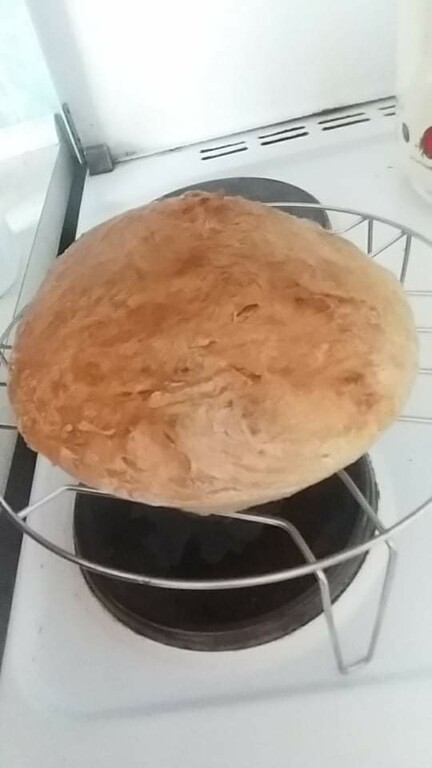
I want to click on oven vent, so click(230, 147), click(286, 137), click(354, 121), click(387, 111).